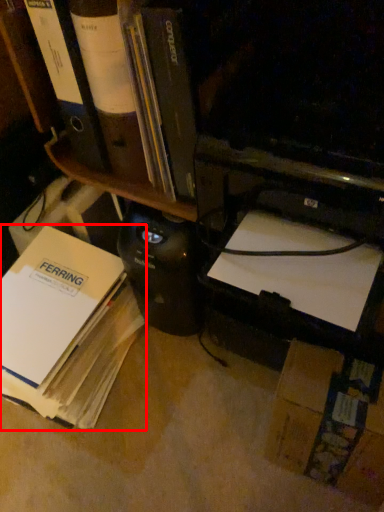
Question: Where is book (annotated by the red box) located in relation to bookshelf in the image?

Choices:
 (A) right
 (B) left

Answer: (B)